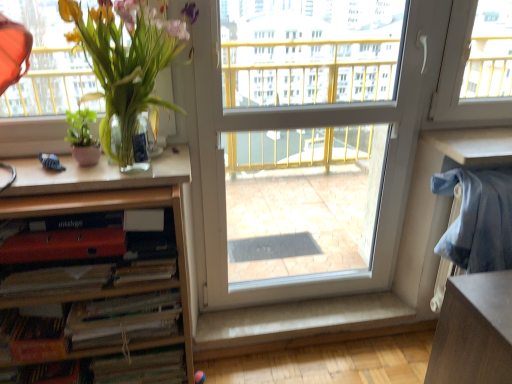
The height and width of the screenshot is (384, 512). In order to click on white fabric at lower center in this screenshot , I will do `click(300, 324)`.

This screenshot has width=512, height=384. Describe the element at coordinates (305, 143) in the screenshot. I see `white plastic screen door at center` at that location.

What is the approximate height of wooden bookshelf at left?

It is 33.35 inches.

This screenshot has height=384, width=512. What do you see at coordinates (82, 137) in the screenshot? I see `green matte plant at left, the second houseplant viewed from the right` at bounding box center [82, 137].

What is the approximate height of green matte plant at left, the second houseplant viewed from the right?

The height of green matte plant at left, the second houseplant viewed from the right, is 7.44 inches.

Where is `matte red paperback book at lower left, the third paperback book ordered from the bottom`? matte red paperback book at lower left, the third paperback book ordered from the bottom is located at coordinates pos(63,245).

Based on the photo, does matte red paperback book at lower left, the third paperback book ordered from the bottom, touch wooden bookshelf at left?

matte red paperback book at lower left, the third paperback book ordered from the bottom, is not next to wooden bookshelf at left, and they're not touching.

Is matte red paperback book at lower left, which is the 1th paperback book in top-to-bottom order, to the right of wooden bookshelf at left from the viewer's perspective?

Correct, you'll find matte red paperback book at lower left, which is the 1th paperback book in top-to-bottom order, to the right of wooden bookshelf at left.

Would you say wooden bookshelf at left is part of matte red paperback book at lower left, the third paperback book ordered from the bottom,'s contents?

That's incorrect, wooden bookshelf at left is not inside matte red paperback book at lower left, the third paperback book ordered from the bottom.

Find the location of `paperback book that is above the wooden bookshelf at left (from a real-world perspective)`. paperback book that is above the wooden bookshelf at left (from a real-world perspective) is located at coordinates (63, 245).

Who is taller, green glossy plant at left, the 2th houseplant viewed from the left, or wooden desk at lower right?

With more height is wooden desk at lower right.

Would you say green glossy plant at left, the 2th houseplant viewed from the left, is outside wooden desk at lower right?

Indeed, green glossy plant at left, the 2th houseplant viewed from the left, is completely outside wooden desk at lower right.

From a real-world perspective, is green glossy plant at left, the 2th houseplant viewed from the left, positioned under wooden desk at lower right based on gravity?

No, from a real-world perspective, green glossy plant at left, the 2th houseplant viewed from the left, is not beneath wooden desk at lower right.

Looking at this image, is green glossy plant at left, the 2th houseplant viewed from the left, at the right side of wooden desk at lower right?

In fact, green glossy plant at left, the 2th houseplant viewed from the left, is to the left of wooden desk at lower right.

Between white fabric at lower center and matte red book at lower left, which one is positioned in front?

Positioned in front is matte red book at lower left.

Is white fabric at lower center inside the boundaries of matte red book at lower left, or outside?

white fabric at lower center is not inside matte red book at lower left, it's outside.

Identify the location of book lying on the left of white fabric at lower center. This screenshot has width=512, height=384. (84, 277).

What's the angular difference between white fabric at lower center and matte red book at lower left's facing directions?

The angular difference between white fabric at lower center and matte red book at lower left is 4.07 degrees.

In the scene shown: Does matte red book at lower left touch white fabric at lower center?

There is a gap between matte red book at lower left and white fabric at lower center.

Considering the sizes of objects matte red book at lower left and white fabric at lower center in the image provided, who is shorter, matte red book at lower left or white fabric at lower center?

white fabric at lower center is shorter.

What's the angular difference between matte red book at lower left and white fabric at lower center's facing directions?

→ The angle between the facing direction of matte red book at lower left and the facing direction of white fabric at lower center is 4.07 degrees.

From the image's perspective, between matte red book at lower left and white fabric at lower center, who is located below?

white fabric at lower center, from the image's perspective.

How far apart are wooden desk at lower right and matte red book at lower left?

wooden desk at lower right and matte red book at lower left are 37.62 inches apart.

Identify the location of book above the wooden desk at lower right (from a real-world perspective). (84, 277).

Is wooden desk at lower right directly adjacent to matte red book at lower left?

No, wooden desk at lower right is not beside matte red book at lower left.

From the image's perspective, does wooden desk at lower right appear higher than matte red book at lower left?

No.

In terms of height, does white fabric at lower center look taller or shorter compared to wooden bookshelf at left?

Clearly, white fabric at lower center is shorter compared to wooden bookshelf at left.

Does white fabric at lower center appear on the left side of wooden bookshelf at left?

Incorrect, white fabric at lower center is not on the left side of wooden bookshelf at left.

This screenshot has width=512, height=384. I want to click on cabinetry on the left of white fabric at lower center, so click(109, 201).

Is the position of matte red book at lower left more distant than that of green matte plant at left, the second houseplant viewed from the right?

No, it is in front of green matte plant at left, the second houseplant viewed from the right.

From the picture: Can you tell me how much matte red book at lower left and green matte plant at left, marked as the first houseplant in a left-to-right arrangement, differ in facing direction?

They differ by 1.86 degrees in their facing directions.

Considering the positions of point (78, 287) and point (76, 114), is point (78, 287) closer or farther from the camera than point (76, 114)?

Clearly, point (78, 287) is closer to the camera than point (76, 114).

Which object is wider, matte red book at lower left or green matte plant at left, marked as the first houseplant in a left-to-right arrangement?

green matte plant at left, marked as the first houseplant in a left-to-right arrangement.

There is a wooden bookshelf at left. What are the coordinates of `paperback book above it (from a real-world perspective)` in the screenshot? It's located at (63, 245).

Image resolution: width=512 pixels, height=384 pixels. What are the coordinates of `computer desk behind the green glossy plant at left, the 2th houseplant viewed from the left` in the screenshot? It's located at (473, 332).

From the picture: Considering their positions, is hardcover book at lower left, marked as the 3th paperback book in a top-to-bottom arrangement, positioned further to white matte paperback book at lower left, which is the second paperback book from bottom to top, than green matte plant at left, the second houseplant viewed from the right?

green matte plant at left, the second houseplant viewed from the right, is positioned further to the anchor white matte paperback book at lower left, which is the second paperback book from bottom to top.

Estimate the real-world distances between objects in this image. Which object is further from white plastic screen door at center, wooden desk at lower right or white fabric at lower center?

Based on the image, wooden desk at lower right appears to be further to white plastic screen door at center.

Considering their positions, is matte red paperback book at lower left, which is the 1th paperback book in top-to-bottom order, positioned closer to wooden bookshelf at left than matte red book at lower left?

matte red paperback book at lower left, which is the 1th paperback book in top-to-bottom order, lies closer to wooden bookshelf at left than the other object.

Based on their spatial positions, is wooden desk at lower right or matte red paperback book at lower left, the third paperback book ordered from the bottom, further from green matte plant at left, the second houseplant viewed from the right?

wooden desk at lower right is further to green matte plant at left, the second houseplant viewed from the right.

When comparing their distances from green glossy plant at left, the 2th houseplant viewed from the left, does wooden desk at lower right or matte red paperback book at lower left, which is the 1th paperback book in top-to-bottom order, seem closer?

matte red paperback book at lower left, which is the 1th paperback book in top-to-bottom order, is positioned closer to the anchor green glossy plant at left, the 2th houseplant viewed from the left.

Considering their positions, is matte red book at lower left positioned further to white fabric at lower center than wooden bookshelf at left?

matte red book at lower left is further to white fabric at lower center.

In the scene shown: From the image, which object appears to be farther from green matte plant at left, marked as the first houseplant in a left-to-right arrangement, matte red paperback book at lower left, the third paperback book ordered from the bottom, or hardcover book at lower left, the first paperback book ordered from the bottom?

The object further to green matte plant at left, marked as the first houseplant in a left-to-right arrangement, is hardcover book at lower left, the first paperback book ordered from the bottom.

From the image, which object appears to be nearer to matte red paperback book at lower left, the third paperback book ordered from the bottom, wooden desk at lower right or green matte plant at left, the second houseplant viewed from the right?

green matte plant at left, the second houseplant viewed from the right.

Find the location of `paperback book located between matte red paperback book at lower left, the third paperback book ordered from the bottom, and white plastic screen door at center in the left-right direction`. paperback book located between matte red paperback book at lower left, the third paperback book ordered from the bottom, and white plastic screen door at center in the left-right direction is located at coordinates coord(123,318).

At what (x,y) coordinates should I click in order to perform the action: click on cabinetry between hardcover book at lower left, marked as the 3th paperback book in a top-to-bottom arrangement, and white matte paperback book at lower left, arranged as the second paperback book when viewed from the top, in the horizontal direction. Please return your answer as a coordinate pair (x, y). Looking at the image, I should click on (109, 201).

You are a GUI agent. You are given a task and a screenshot of the screen. Output one action in this format:
    pyautogui.click(x=<x>, y=<y>)
    Task: Click on the houseplant between white matte paperback book at lower left, arranged as the second paperback book when viewed from the top, and wooden desk at lower right
    
    Given the screenshot: What is the action you would take?
    pyautogui.click(x=127, y=60)

Where is `cabinetry positioned between green glossy plant at left, which is counted as the first houseplant, starting from the right, and white fabric at lower center from near to far`? This screenshot has height=384, width=512. cabinetry positioned between green glossy plant at left, which is counted as the first houseplant, starting from the right, and white fabric at lower center from near to far is located at coordinates (109, 201).